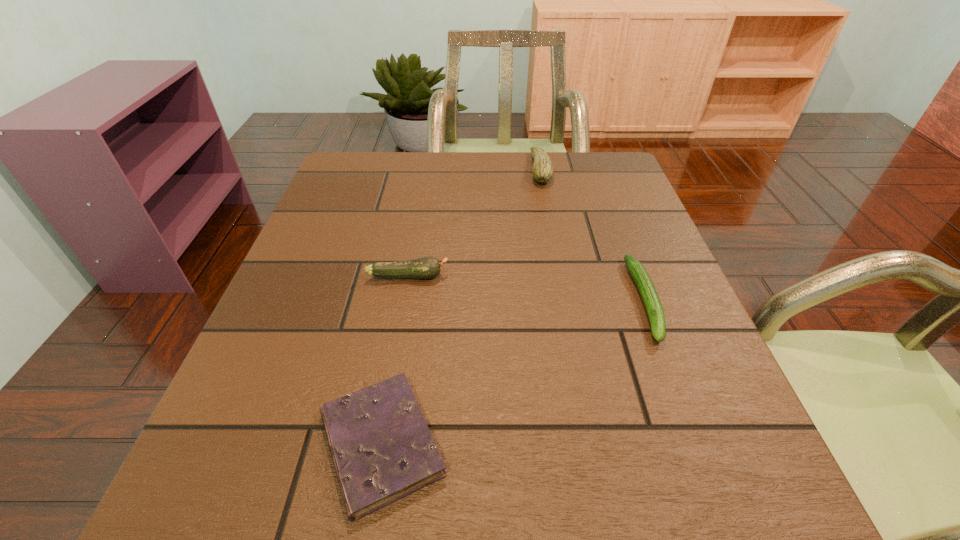
Find the location of a particular element. free region at the near edge is located at coordinates (560, 500).

The width and height of the screenshot is (960, 540). I want to click on vacant space at the left edge of the desktop, so click(x=349, y=300).

You are a GUI agent. You are given a task and a screenshot of the screen. Output one action in this format:
    pyautogui.click(x=<x>, y=<y>)
    Task: Click on the vacant space at the right edge of the desktop
    The image size is (960, 540).
    Given the screenshot: What is the action you would take?
    pyautogui.click(x=665, y=409)

You are a GUI agent. You are given a task and a screenshot of the screen. Output one action in this format:
    pyautogui.click(x=<x>, y=<y>)
    Task: Click on the free region at the far left corner of the desktop
    The width and height of the screenshot is (960, 540).
    Given the screenshot: What is the action you would take?
    pyautogui.click(x=386, y=181)

Where is `vacant space at the near right corner of the desktop`? vacant space at the near right corner of the desktop is located at coordinates (692, 534).

Locate an element on the screen. empty space between the rightmost object and the farthest object is located at coordinates (592, 235).

I want to click on free point between the second tallest zucchini and the rightmost zucchini, so click(527, 288).

At what (x,y) coordinates should I click in order to perform the action: click on vacant area that lies between the shortest object and the farthest object. Please return your answer as a coordinate pair (x, y). This screenshot has width=960, height=540. Looking at the image, I should click on (461, 307).

This screenshot has width=960, height=540. I want to click on vacant area between the second object from right to left and the nearest object, so click(x=461, y=307).

Locate an element on the screen. vacant region between the diary and the second shortest zucchini is located at coordinates (395, 360).